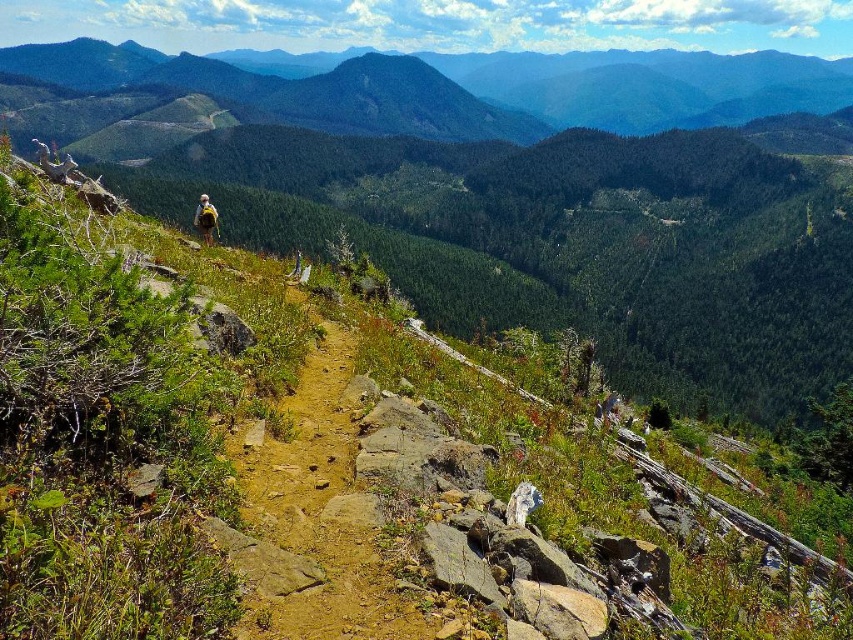
Question: Is green forested mountain at upper center above dirt path at center?

Choices:
 (A) no
 (B) yes

Answer: (B)

Question: In this image, where is green forested mountain at upper center located relative to dirt path at center?

Choices:
 (A) below
 (B) above

Answer: (B)

Question: Which object is positioned farthest from the dirt path at center?

Choices:
 (A) green forested mountain at upper center
 (B) camouflage backpack at upper left

Answer: (A)

Question: Estimate the real-world distances between objects in this image. Which object is farther from the green forested mountain at upper center?

Choices:
 (A) camouflage backpack at upper left
 (B) dirt path at center

Answer: (B)

Question: Can you confirm if dirt path at center is thinner than camouflage backpack at upper left?

Choices:
 (A) no
 (B) yes

Answer: (B)

Question: Considering the real-world distances, which object is closest to the green forested mountain at upper center?

Choices:
 (A) dirt path at center
 (B) camouflage backpack at upper left

Answer: (B)